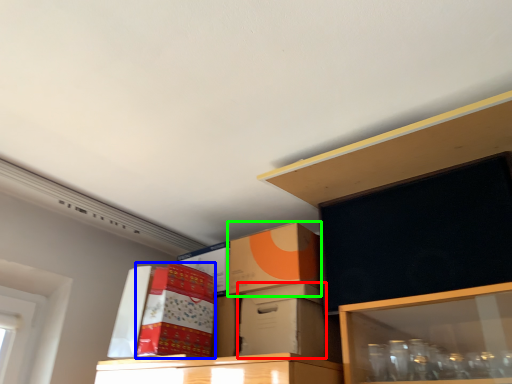
Question: Which object is positioned farthest from box (highlighted by a red box)? Select from storage box (highlighted by a blue box) and box (highlighted by a green box).

Choices:
 (A) storage box
 (B) box

Answer: (A)